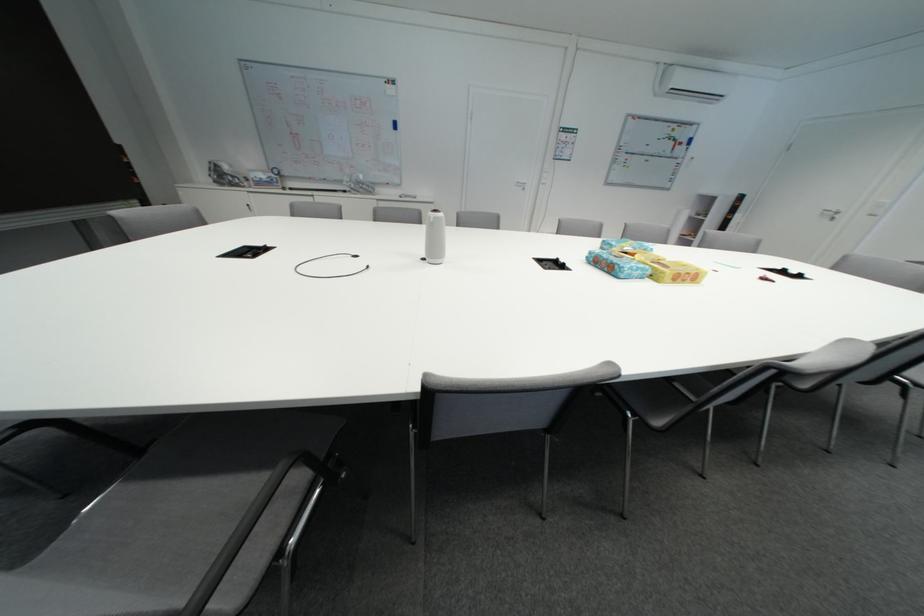
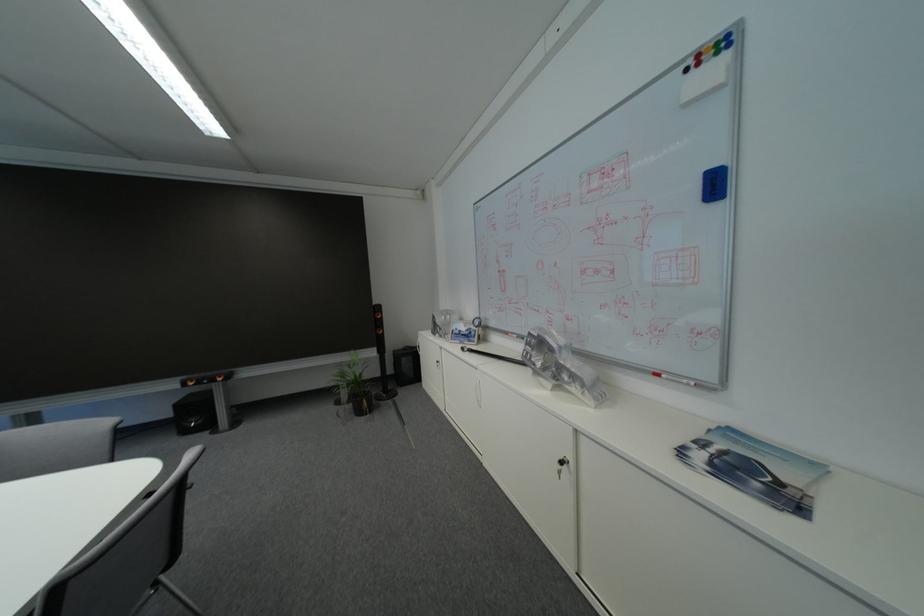
Where in the second image is the point corresponding to the point at 406,128 from the first image?

(726, 188)